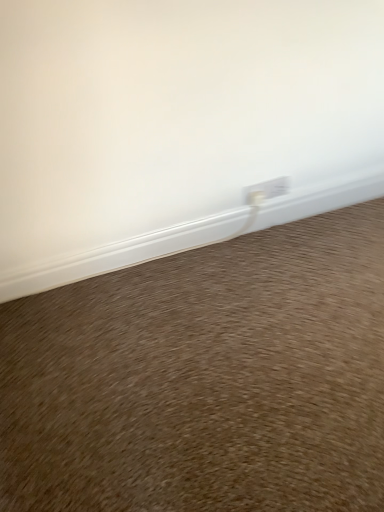
What is the approximate height of white plastic window sill at lower center?

white plastic window sill at lower center is 6.18 inches tall.

This screenshot has width=384, height=512. What do you see at coordinates (201, 232) in the screenshot?
I see `white plastic window sill at lower center` at bounding box center [201, 232].

The image size is (384, 512). What are the coordinates of `white plastic window sill at lower center` in the screenshot? It's located at (201, 232).

What is the approximate width of white plastic window sill at lower center?

It is 1.07 inches.

Measure the distance between point [207,233] and camera.

A distance of 4.90 feet exists between point [207,233] and camera.

Measure the distance between point (286, 257) and camera.

Point (286, 257) and camera are 4.89 feet apart from each other.

The width and height of the screenshot is (384, 512). What are the coordinates of `brown carpet at lower center` in the screenshot? It's located at point(205,379).

Describe the element at coordinates (205, 379) in the screenshot. Image resolution: width=384 pixels, height=512 pixels. I see `brown carpet at lower center` at that location.

The height and width of the screenshot is (512, 384). I want to click on white plastic window sill at lower center, so click(x=201, y=232).

Is brown carpet at lower center to the left of white plastic window sill at lower center from the viewer's perspective?

In fact, brown carpet at lower center is to the right of white plastic window sill at lower center.

Is brown carpet at lower center in front of or behind white plastic window sill at lower center in the image?

In the image, brown carpet at lower center appears in front of white plastic window sill at lower center.

Based on the photo, which is further, (315, 488) or (138, 250)?

Positioned behind is point (138, 250).

From the image's perspective, is brown carpet at lower center located above white plastic window sill at lower center?

Incorrect, from the image's perspective, brown carpet at lower center is lower than white plastic window sill at lower center.

From a real-world perspective, which object stands above the other?

white plastic window sill at lower center.

Does brown carpet at lower center have a lesser width compared to white plastic window sill at lower center?

No, brown carpet at lower center is not thinner than white plastic window sill at lower center.

Who is shorter, brown carpet at lower center or white plastic window sill at lower center?

brown carpet at lower center is shorter.

In the scene shown: Is brown carpet at lower center bigger or smaller than white plastic window sill at lower center?

Considering their sizes, brown carpet at lower center takes up more space than white plastic window sill at lower center.

Is brown carpet at lower center not inside white plastic window sill at lower center?

Yes, brown carpet at lower center is located beyond the bounds of white plastic window sill at lower center.

Is brown carpet at lower center in contact with white plastic window sill at lower center?

No.

In the scene shown: Is white plastic window sill at lower center at the back of brown carpet at lower center?

brown carpet at lower center is not turned away from white plastic window sill at lower center.

How many degrees apart are the facing directions of brown carpet at lower center and white plastic window sill at lower center?

There is a 90-degree angle between the facing directions of brown carpet at lower center and white plastic window sill at lower center.

Locate an element on the screen. Image resolution: width=384 pixels, height=512 pixels. window sill behind the brown carpet at lower center is located at coordinates (201, 232).

From the picture: Can you confirm if white plastic window sill at lower center is positioned to the right of brown carpet at lower center?

In fact, white plastic window sill at lower center is to the left of brown carpet at lower center.

Consider the image. Which object is more forward, white plastic window sill at lower center or brown carpet at lower center?

brown carpet at lower center is closer to the camera.

Which is more distant, [83,264] or [138,506]?

The point [83,264] is more distant.

From the image's perspective, is white plastic window sill at lower center beneath brown carpet at lower center?

Incorrect, from the image's perspective, white plastic window sill at lower center is higher than brown carpet at lower center.

From a real-world perspective, is white plastic window sill at lower center beneath brown carpet at lower center?

No, from a real-world perspective, white plastic window sill at lower center is not under brown carpet at lower center.

Considering the sizes of objects white plastic window sill at lower center and brown carpet at lower center in the image provided, who is wider, white plastic window sill at lower center or brown carpet at lower center?

brown carpet at lower center.

Does white plastic window sill at lower center have a lesser height compared to brown carpet at lower center?

No.

Considering the relative sizes of white plastic window sill at lower center and brown carpet at lower center in the image provided, is white plastic window sill at lower center bigger than brown carpet at lower center?

No, white plastic window sill at lower center is not bigger than brown carpet at lower center.

Which is correct: white plastic window sill at lower center is inside brown carpet at lower center, or outside of it?

white plastic window sill at lower center is outside brown carpet at lower center.

Are white plastic window sill at lower center and brown carpet at lower center making contact?

There is a gap between white plastic window sill at lower center and brown carpet at lower center.

Does white plastic window sill at lower center turn towards brown carpet at lower center?

Yes, white plastic window sill at lower center is oriented towards brown carpet at lower center.

Find the location of `sand below the white plastic window sill at lower center (from the image's perspective)`. sand below the white plastic window sill at lower center (from the image's perspective) is located at coordinates (205, 379).

The height and width of the screenshot is (512, 384). I want to click on window sill above the brown carpet at lower center (from a real-world perspective), so click(201, 232).

Locate an element on the screen. window sill behind the brown carpet at lower center is located at coordinates (201, 232).